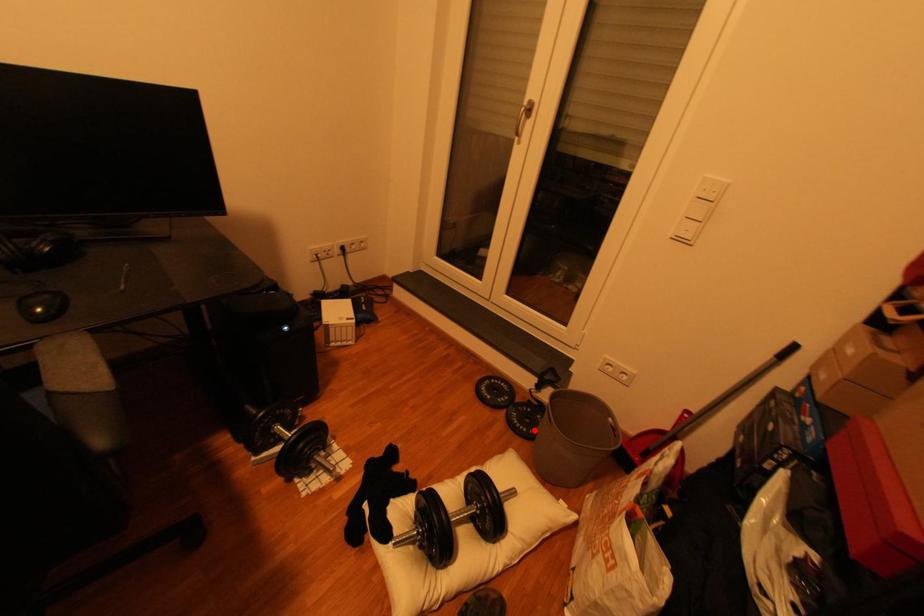
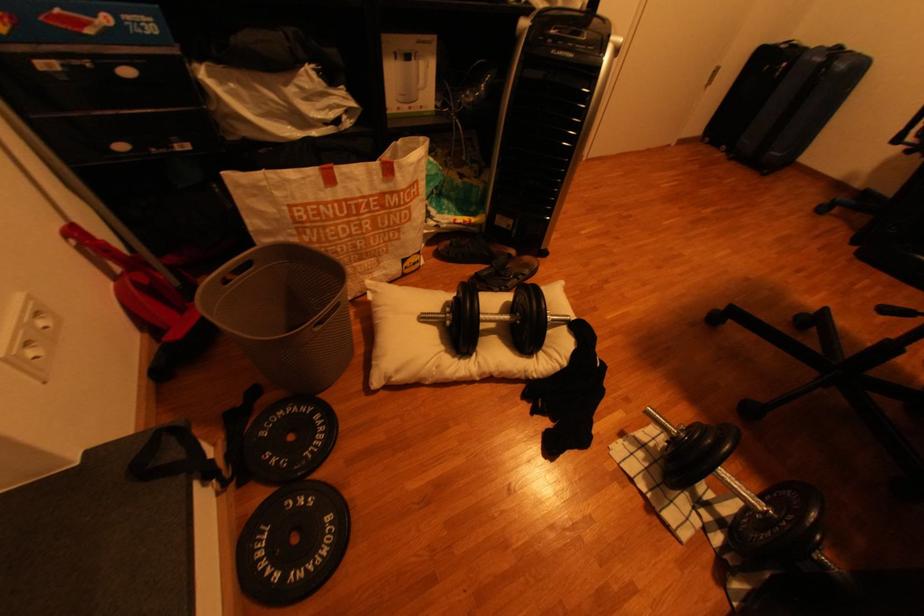
Locate, in the second image, the point that corresponds to the highlighted location in the first image.

(325, 419)